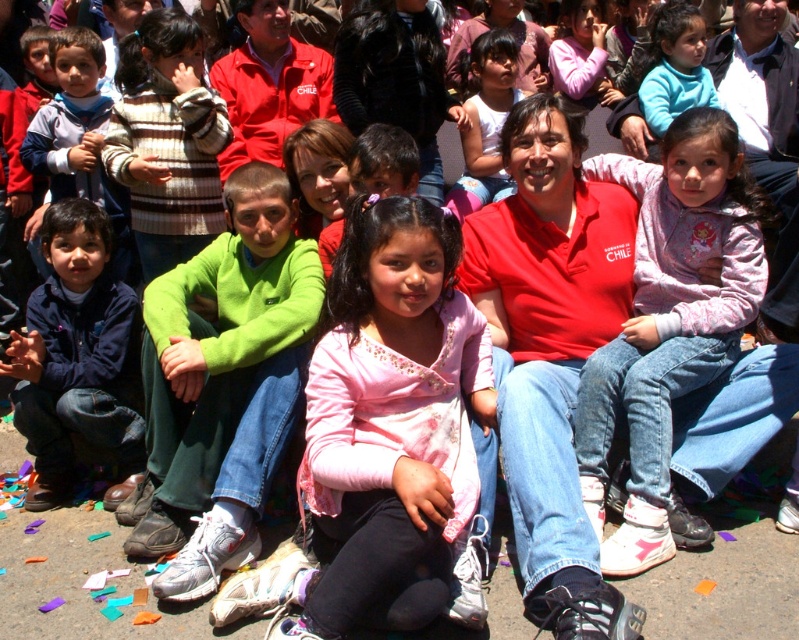
Question: Among these objects, which one is nearest to the camera?

Choices:
 (A) striped sweater at left
 (B) pink satin shirt at center

Answer: (B)

Question: Is pink satin shirt at center thinner than pink satin dress at center?

Choices:
 (A) no
 (B) yes

Answer: (A)

Question: Can you confirm if striped sweater at left is smaller than matte blue sweater at upper right?

Choices:
 (A) no
 (B) yes

Answer: (A)

Question: Does striped sweater at left have a greater width compared to pink satin dress at center?

Choices:
 (A) yes
 (B) no

Answer: (A)

Question: Which object is the farthest from the matte blue sweater at upper right?

Choices:
 (A) pink fleece jacket at center
 (B) pink satin shirt at center
 (C) striped sweater at left

Answer: (C)

Question: Which object is closer to the camera taking this photo?

Choices:
 (A) matte blue sweater at upper right
 (B) pink satin dress at center
 (C) striped sweater at left
 (D) pink satin shirt at center

Answer: (D)